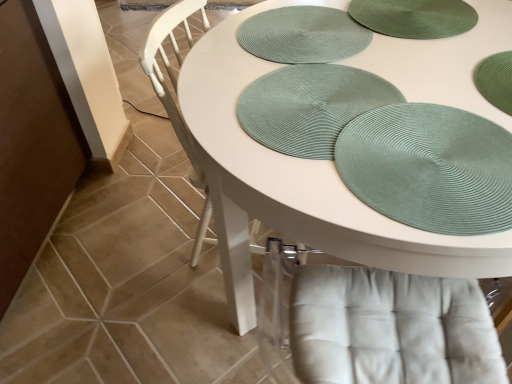
Where is `free space between green textured placemat at upper center, placed as the 1th platter when sorted from back to front, and green woven placemat at center, placed as the first platter when sorted from front to back`? This screenshot has width=512, height=384. free space between green textured placemat at upper center, placed as the 1th platter when sorted from back to front, and green woven placemat at center, placed as the first platter when sorted from front to back is located at coordinates (315, 68).